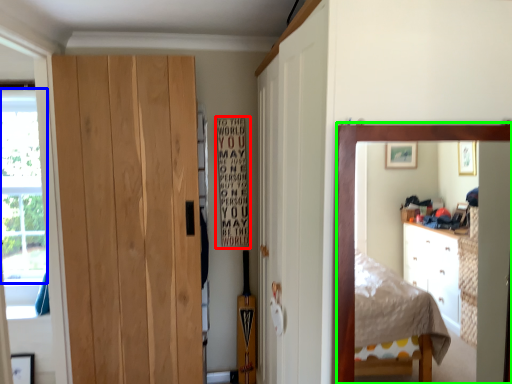
Question: Based on their relative distances, which object is farther from bulletin board (highlighted by a red box)? Choose from window screen (highlighted by a blue box) and mirror (highlighted by a green box).

Choices:
 (A) window screen
 (B) mirror

Answer: (B)